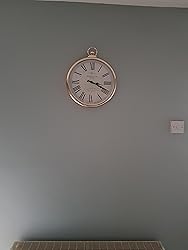
What are the coordinates of `wall` in the screenshot? It's located at (157, 194).